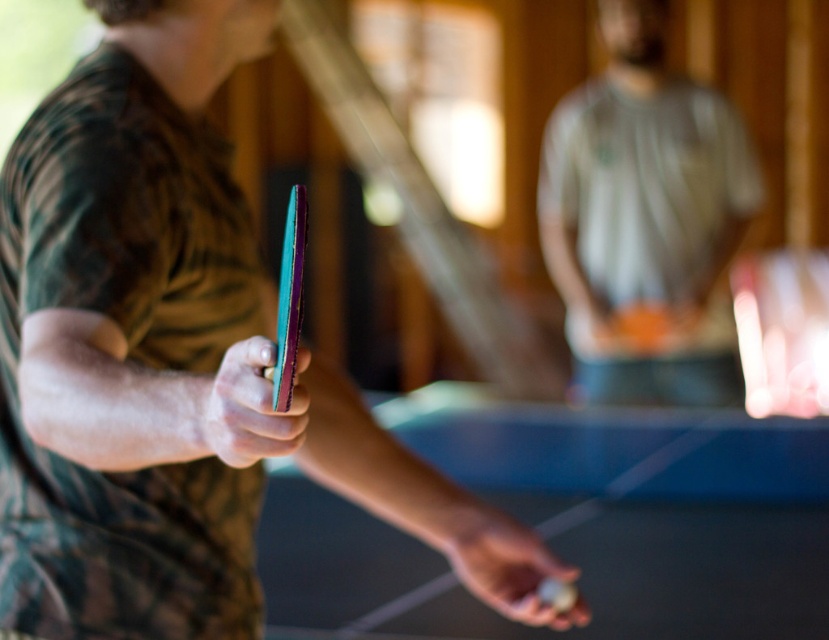
In the image of the table tennis game, where is the matte gray shirt at center located in terms of its 2D coordinates?

The matte gray shirt at center is located at the 2D coordinates point (x=645, y=220).

In the scene shown: You are a table tennis player who wants to hit the ball with your racket. The teal rubber paddle at center and shiny metallic racket at center are both on the table. If the ball is exactly halfway between them, which racket should you aim for to hit the ball first?

The teal rubber paddle at center is 8.58 inches from shiny metallic racket at center. Since the ball is halfway between them, you should aim for the shiny metallic racket at center because it is closer to your position if you are holding the teal rubber paddle at center.

In the scene shown: You are a table tennis player who wants to choose a paddle with a wider grip. Based on the scene, which object should you select between the teal rubber paddle at center and the shiny metallic racket at center?

The teal rubber paddle at center has a greater width than the shiny metallic racket at center, so you should choose the teal rubber paddle at center for a wider grip.